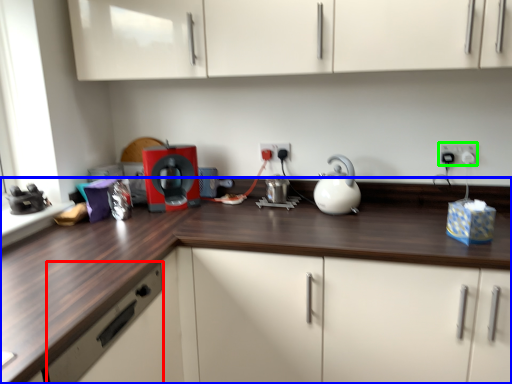
Question: Which object is positioned closest to drawer (highlighted by a red box)? Select from countertop (highlighted by a blue box) and electric outlet (highlighted by a green box).

Choices:
 (A) countertop
 (B) electric outlet

Answer: (A)